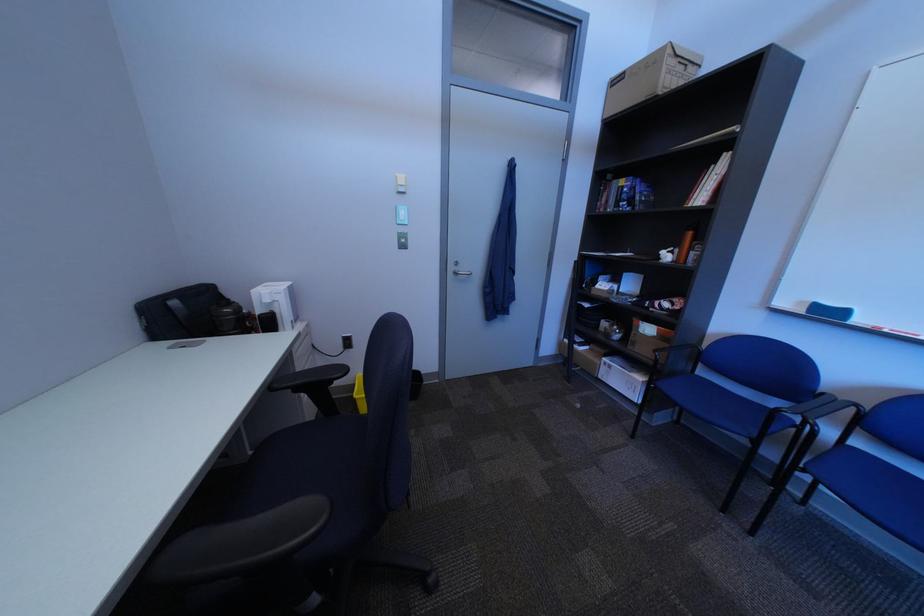
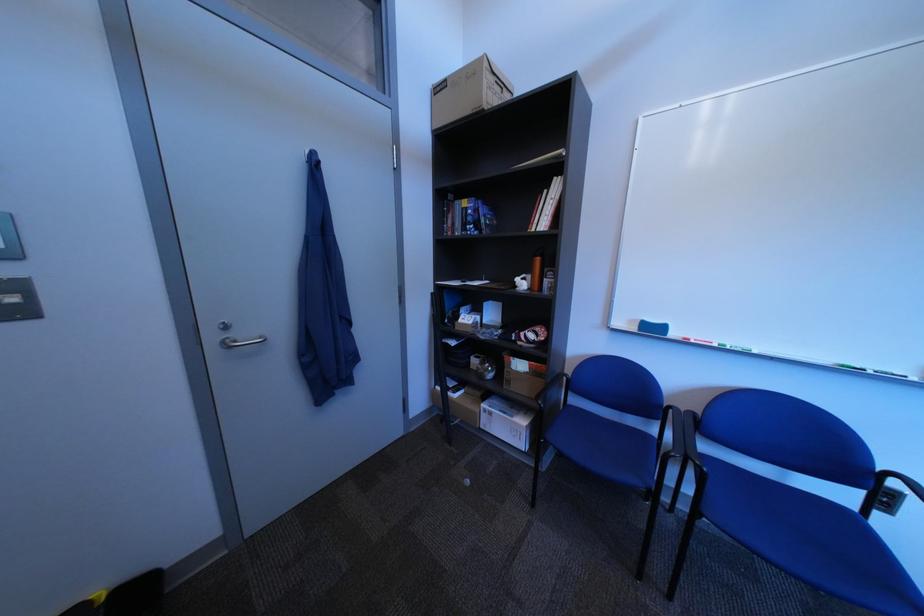
In the second image, find the point that corresponds to point (614, 379) in the first image.

(496, 429)